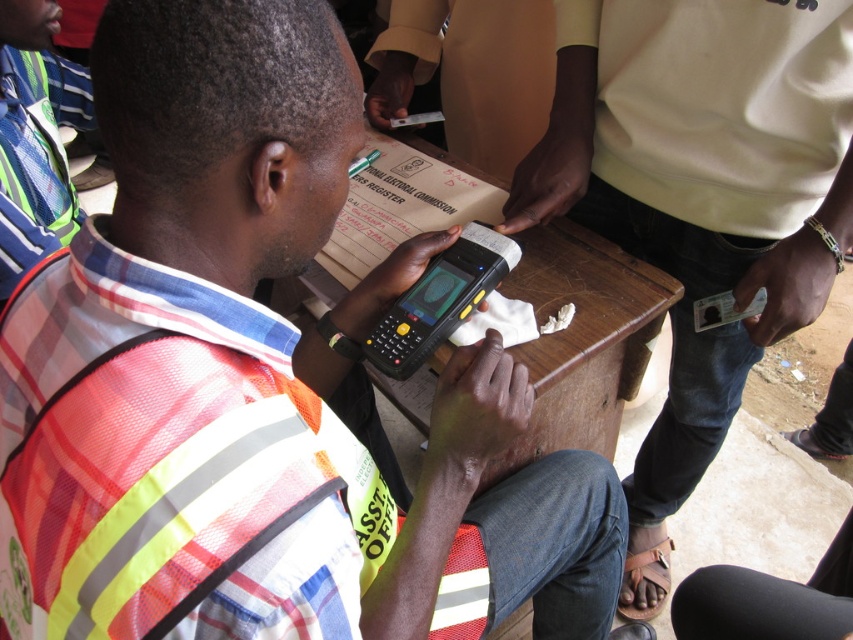
Image resolution: width=853 pixels, height=640 pixels. What do you see at coordinates (700, 198) in the screenshot?
I see `reflective safety vest at center` at bounding box center [700, 198].

Which is behind, point (656, 52) or point (408, 419)?

Point (408, 419)

This screenshot has width=853, height=640. I want to click on reflective safety vest at center, so click(700, 198).

Does reflective orange vest at center come behind wooden table at center?

No, reflective orange vest at center is closer to the viewer.

Is reflective orange vest at center below wooden table at center?

Yes, reflective orange vest at center is below wooden table at center.

Image resolution: width=853 pixels, height=640 pixels. Describe the element at coordinates (253, 381) in the screenshot. I see `reflective orange vest at center` at that location.

At what (x,y) coordinates should I click in order to perform the action: click on reflective orange vest at center. Please return your answer as a coordinate pair (x, y). The height and width of the screenshot is (640, 853). Looking at the image, I should click on (253, 381).

Is reflective orange vest at center thinner than reflective safety vest at center?

Incorrect, reflective orange vest at center's width is not less than reflective safety vest at center's.

Where is `reflective orange vest at center`? reflective orange vest at center is located at coordinates (253, 381).